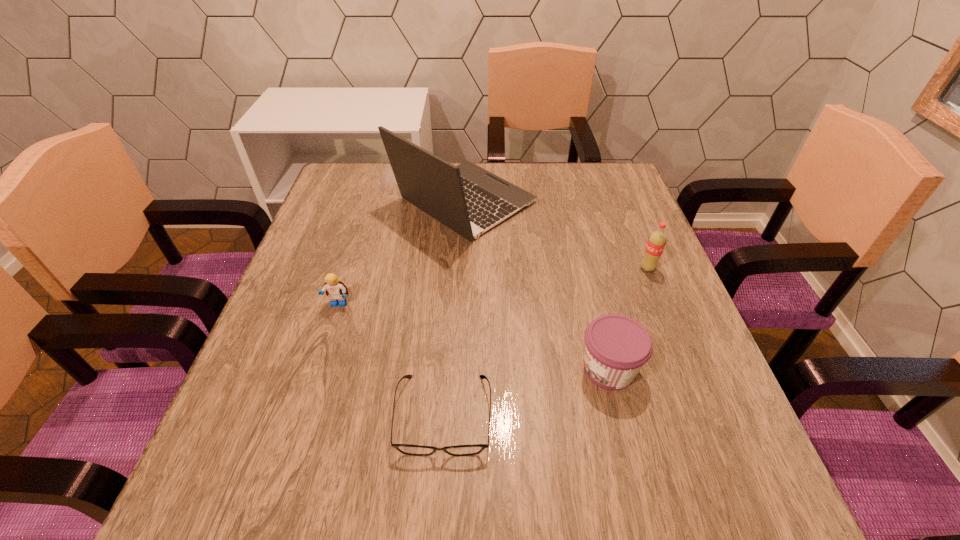
This screenshot has width=960, height=540. In order to click on vacant space at the near edge of the desktop in this screenshot , I will do `click(482, 493)`.

The width and height of the screenshot is (960, 540). Identify the location of vacant region at the left edge of the desktop. (312, 254).

Where is `free space at the right edge of the desktop`? The width and height of the screenshot is (960, 540). free space at the right edge of the desktop is located at coordinates (635, 386).

The height and width of the screenshot is (540, 960). I want to click on vacant space at the far left corner of the desktop, so click(x=390, y=176).

At what (x,y) coordinates should I click in order to perform the action: click on free point at the far right corner. Please return your answer as a coordinate pair (x, y). This screenshot has height=540, width=960. Looking at the image, I should click on (571, 174).

Locate an element on the screen. Image resolution: width=960 pixels, height=540 pixels. vacant space that is in between the fourth object from left to right and the shortest object is located at coordinates (526, 392).

Identify the location of vacant area between the jam and the leftmost object. The width and height of the screenshot is (960, 540). (473, 336).

Locate an element on the screen. This screenshot has width=960, height=540. empty space between the leftmost object and the shortest object is located at coordinates (391, 360).

At what (x,y) coordinates should I click in order to perform the action: click on empty location between the second farthest object and the laptop_computer. Please return your answer as a coordinate pair (x, y). This screenshot has width=960, height=540. Looking at the image, I should click on (556, 235).

I want to click on vacant space that's between the tallest object and the soda, so click(x=556, y=235).